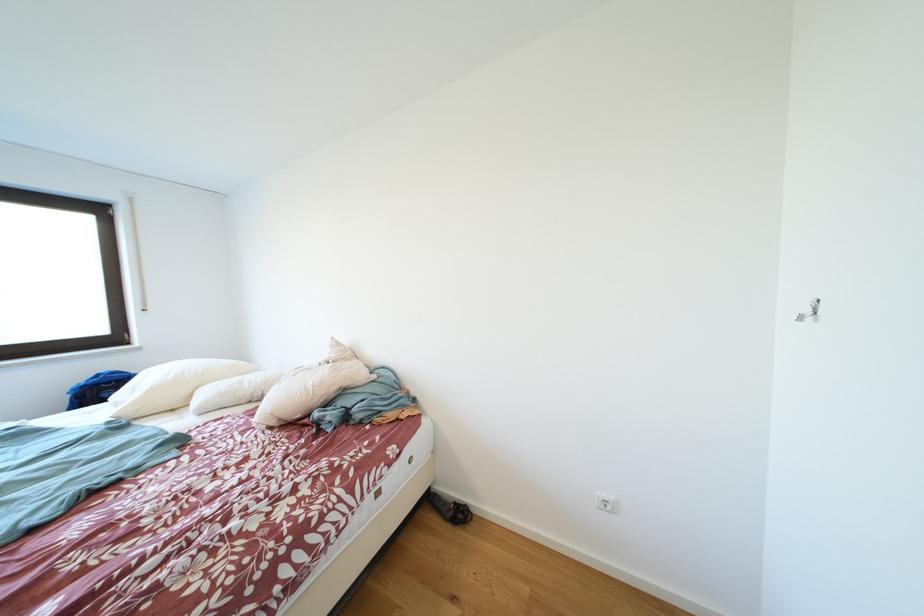
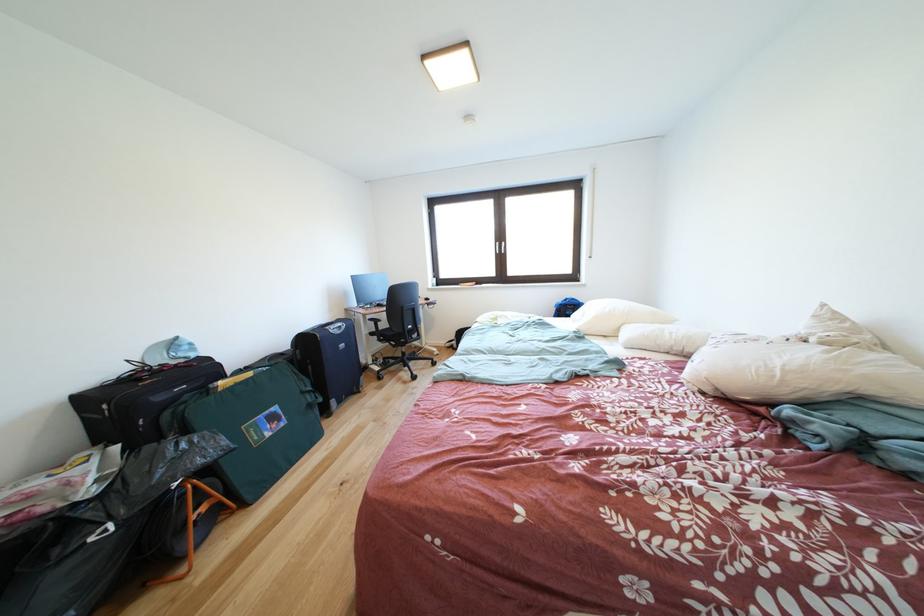
In the second image, find the point that corresponds to point 116,387 in the first image.

(578, 310)